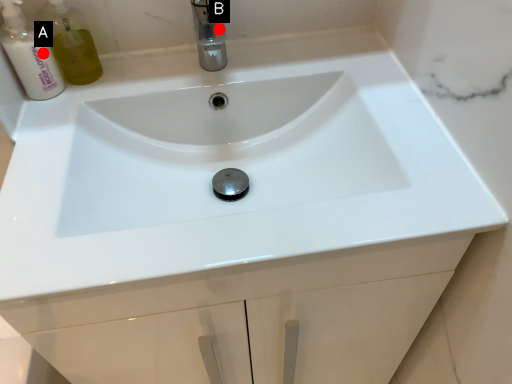
Question: Two points are circled on the image, labeled by A and B beside each circle. Which point is farther to the camera?

Choices:
 (A) A is further
 (B) B is further

Answer: (B)